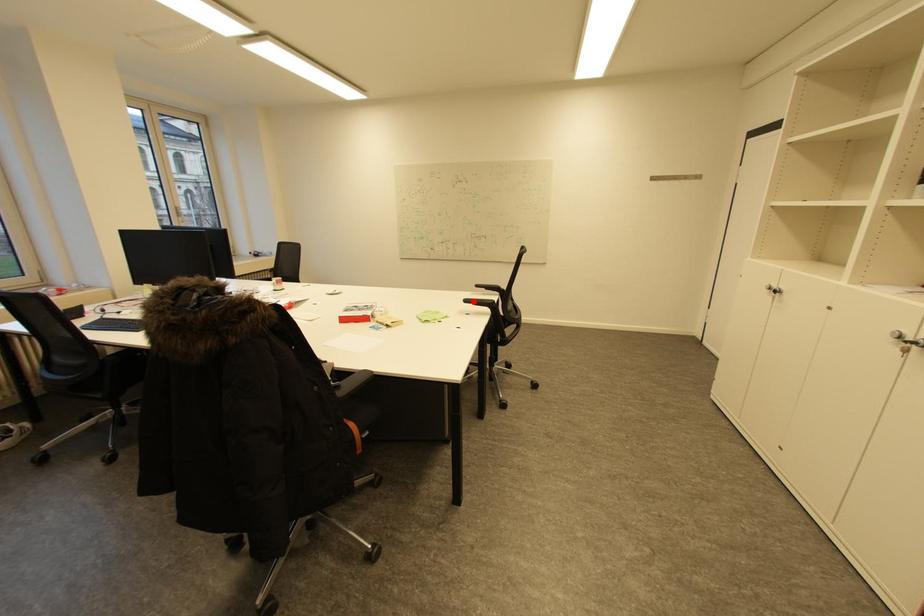
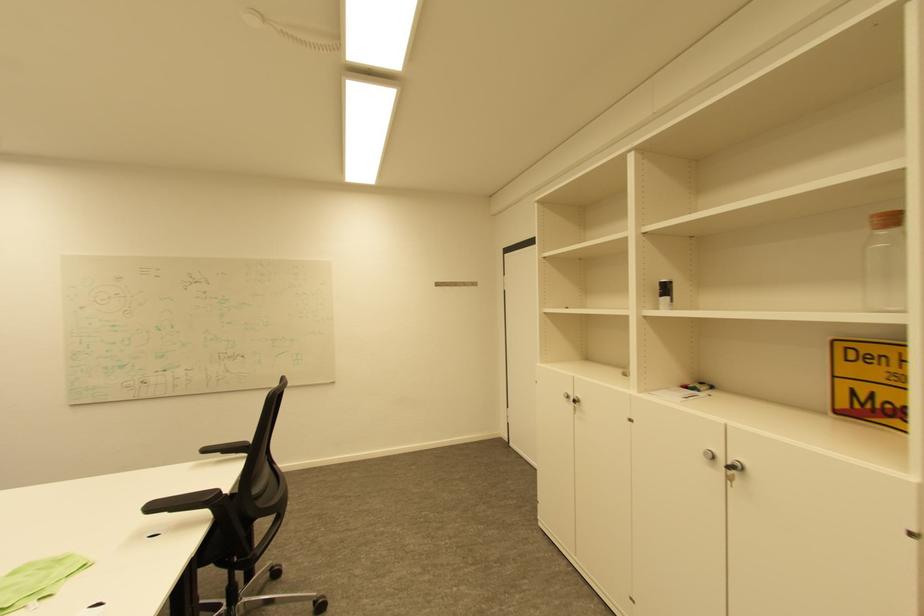
The point at the highlighted location is marked in the first image. Where is the corresponding point in the second image?

(159, 508)